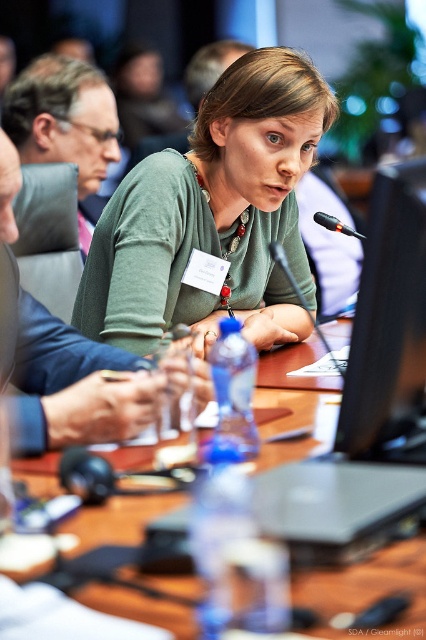
Between point (210, 288) and point (183, 593), which one is positioned behind?

Point (210, 288)

Who is positioned more to the left, green matte shirt at center or wooden table at center?

wooden table at center is more to the left.

Identify the location of green matte shirt at center. Image resolution: width=426 pixels, height=640 pixels. (213, 218).

Who is taller, black glossy monitor at center right or wooden table at center?

black glossy monitor at center right is taller.

Image resolution: width=426 pixels, height=640 pixels. What do you see at coordinates (388, 326) in the screenshot? I see `black glossy monitor at center right` at bounding box center [388, 326].

Who is more forward, (362, 269) or (137, 604)?

Point (137, 604) is in front.

Locate an element on the screen. This screenshot has width=426, height=640. black glossy monitor at center right is located at coordinates (388, 326).

Who is taller, green matte shirt at center or black glossy monitor at center right?

green matte shirt at center

At what (x,y) coordinates should I click in order to perform the action: click on green matte shirt at center. Please return your answer as a coordinate pair (x, y). Looking at the image, I should click on (213, 218).